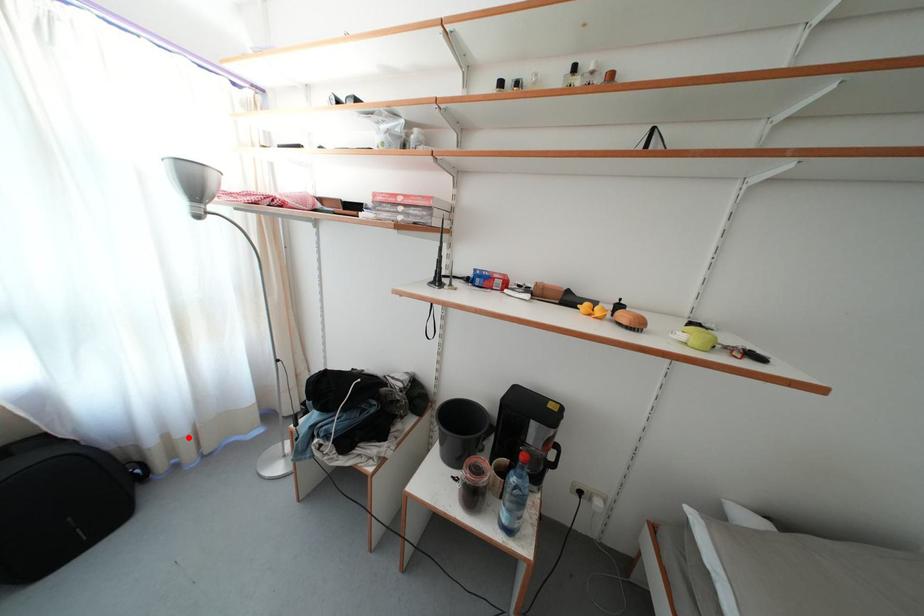
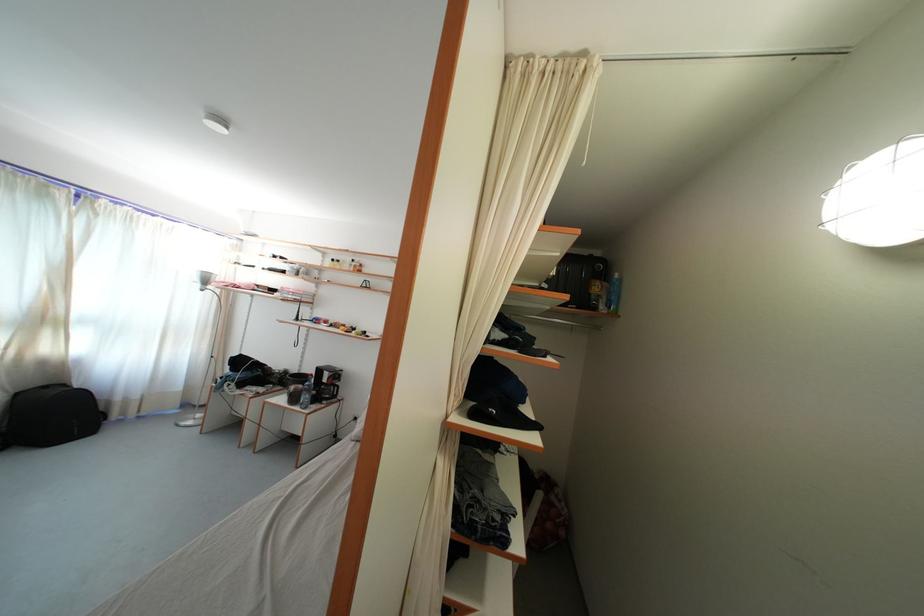
Locate, in the second image, the point that corresponds to the highlighted location in the first image.

(141, 403)